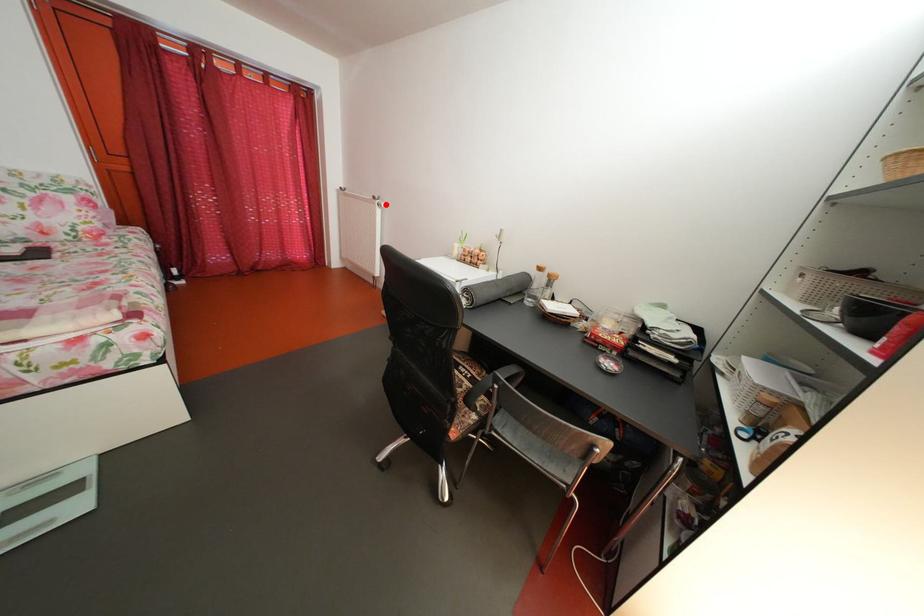
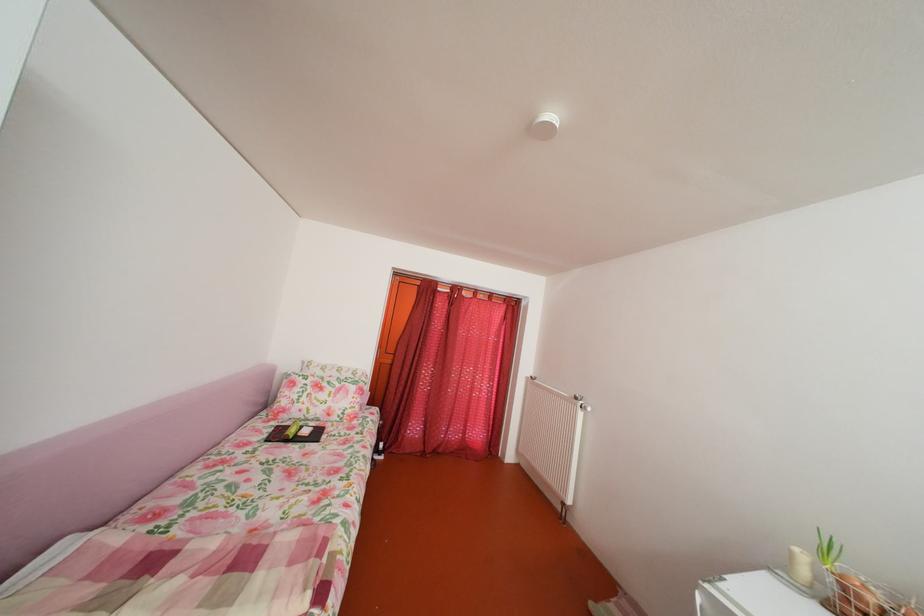
Find the pixel in the second image that matches the highlighted location in the first image.

(588, 405)